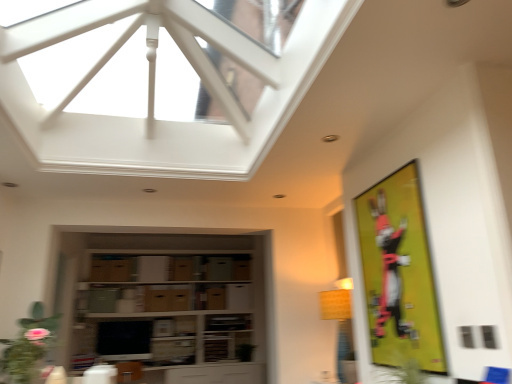
Question: Would you say yellow matte bulletin board at right is inside or outside white glass window at upper center?

Choices:
 (A) outside
 (B) inside

Answer: (A)

Question: From their relative heights in the image, would you say yellow matte bulletin board at right is taller or shorter than white glass window at upper center?

Choices:
 (A) short
 (B) tall

Answer: (B)

Question: Estimate the real-world distances between objects in this image. Which object is closer to the matte wooden entertainment center at center?

Choices:
 (A) matte black monitor at center
 (B) white glass window at upper center
 (C) green matte plant at lower left
 (D) yellow matte bulletin board at right

Answer: (A)

Question: Based on their relative distances, which object is nearer to the green matte plant at lower left?

Choices:
 (A) matte wooden entertainment center at center
 (B) matte black monitor at center
 (C) yellow matte bulletin board at right
 (D) white glass window at upper center

Answer: (D)